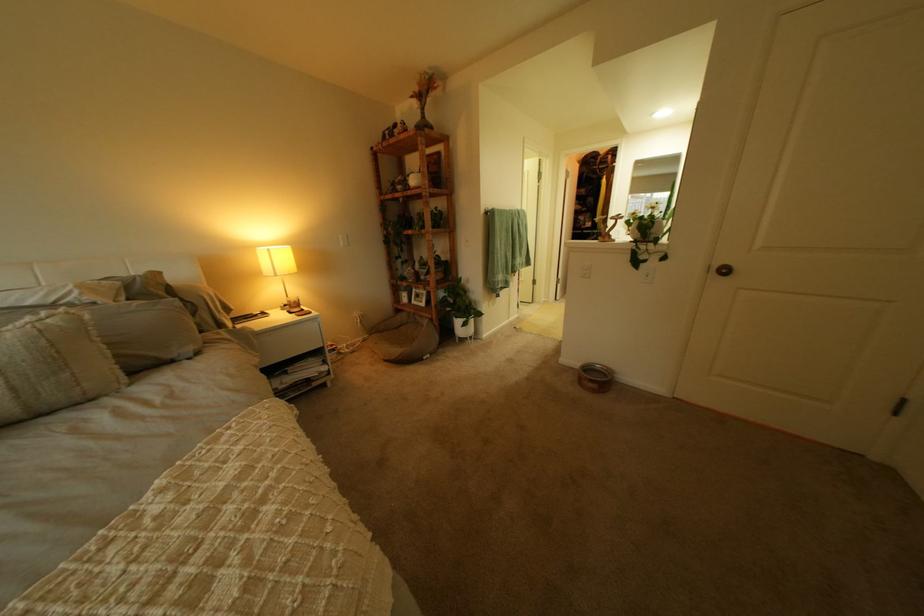
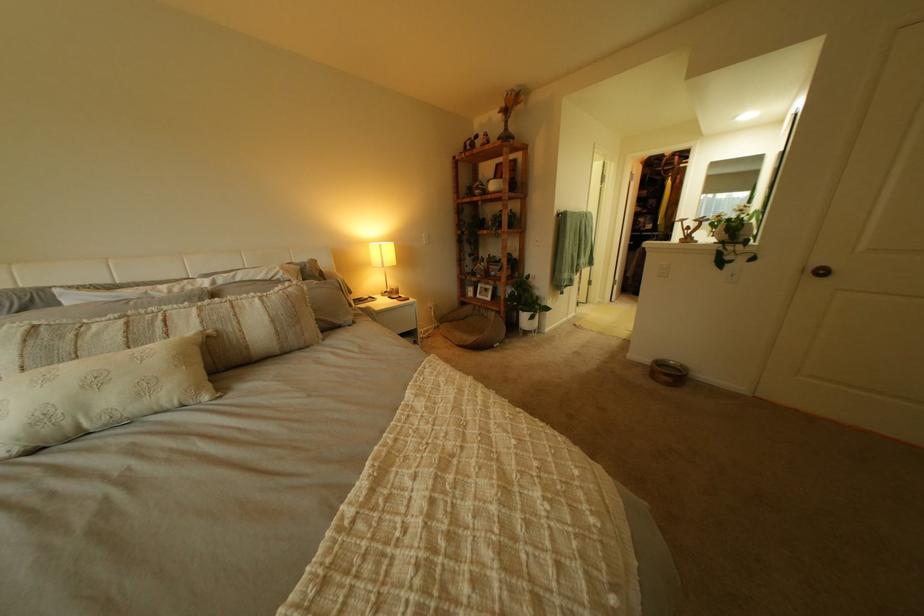
Question: Based on the continuous images, in which direction is the camera rotating? Reply with the corresponding letter.

Choices:
 (A) Left
 (B) Right
 (C) Up
 (D) Down

Answer: (A)